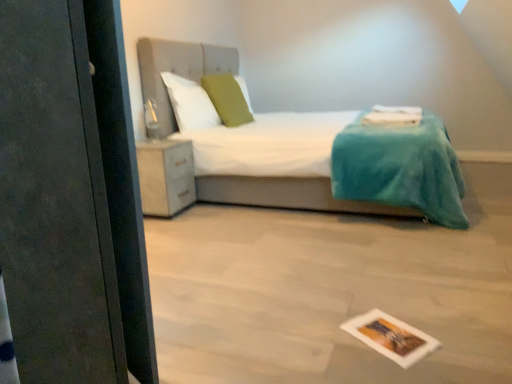
Question: Looking at their shapes, would you say green fabric pillow at center, the 2th pillow in the left-to-right sequence, is wider or thinner than white soft pillow at upper center, which is the second pillow in right-to-left order?

Choices:
 (A) wide
 (B) thin

Answer: (A)

Question: From their relative heights in the image, would you say green fabric pillow at center, the 2th pillow in the left-to-right sequence, is taller or shorter than white soft pillow at upper center, which is the second pillow in right-to-left order?

Choices:
 (A) short
 (B) tall

Answer: (B)

Question: Estimate the real-world distances between objects in this image. Which object is farther from the printed paper postcard at lower center?

Choices:
 (A) white soft pillow at upper center, which is counted as the first pillow, starting from the left
 (B) matte black screen door at left
 (C) green fabric pillow at center, the 2th pillow in the left-to-right sequence
 (D) matte white cabinet at lower left
 (E) white fabric bed at center

Answer: (C)

Question: Considering the real-world distances, which object is farthest from the matte black screen door at left?

Choices:
 (A) white fabric bed at center
 (B) white soft pillow at upper center, which is counted as the first pillow, starting from the left
 (C) printed paper postcard at lower center
 (D) green fabric pillow at center, the 2th pillow in the left-to-right sequence
 (E) matte white cabinet at lower left

Answer: (D)